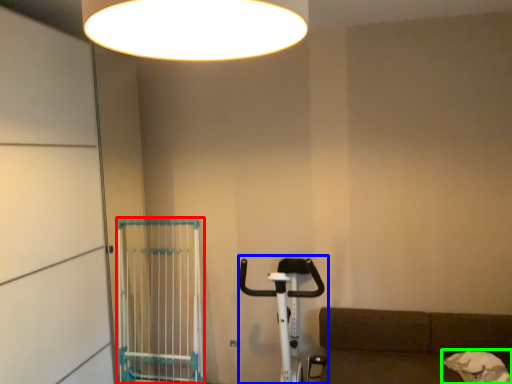
Question: Which object is positioned closest to cage (highlighted by a red box)? Select from baby carriage (highlighted by a blue box) and dog (highlighted by a green box).

Choices:
 (A) baby carriage
 (B) dog

Answer: (A)